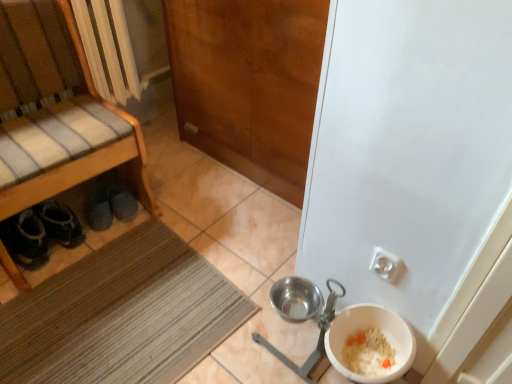
Question: Visually, is white plastic bowl at lower right positioned to the left or to the right of wooden bench at left?

Choices:
 (A) left
 (B) right

Answer: (B)

Question: Considering the positions of white plastic bowl at lower right and wooden bench at left in the image, is white plastic bowl at lower right bigger or smaller than wooden bench at left?

Choices:
 (A) small
 (B) big

Answer: (A)

Question: Based on their relative distances, which object is farther from the wooden door at center?

Choices:
 (A) wooden bench at left
 (B) dark gray fabric shoes at lower left
 (C) brown textured mat at lower left
 (D) white plastic bowl at lower right

Answer: (D)

Question: Estimate the real-world distances between objects in this image. Which object is closer to the wooden bench at left?

Choices:
 (A) dark gray fabric shoes at lower left
 (B) white plastic bowl at lower right
 (C) brown textured mat at lower left
 (D) wooden door at center

Answer: (A)